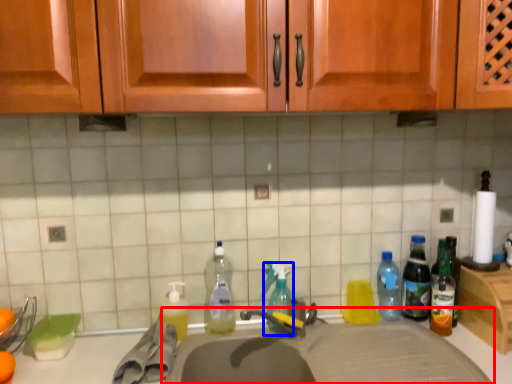
Question: Which object is further to the camera taking this photo, sink (highlighted by a red box) or bottle (highlighted by a blue box)?

Choices:
 (A) sink
 (B) bottle

Answer: (B)